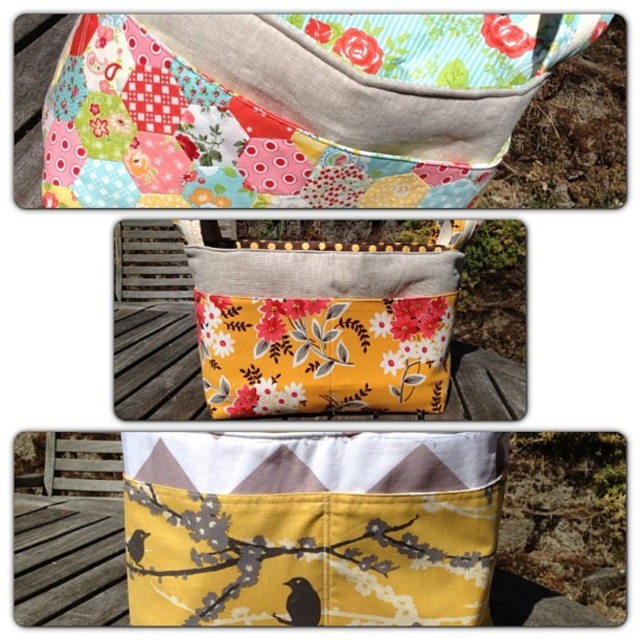
Is yellow fabric pouch at center bigger than black matte bird at lower center?

Yes.

In the scene shown: Between yellow fabric pouch at center and black matte bird at lower center, which one is positioned higher?

Positioned higher is yellow fabric pouch at center.

Where is `yellow fabric pouch at center`? The height and width of the screenshot is (640, 640). yellow fabric pouch at center is located at coordinates (312, 525).

Identify the location of yellow fabric pouch at center. (312, 525).

Which of these two, yellow floral fabric pouch at center or yellow fabric branch at center, stands taller?

Standing taller between the two is yellow floral fabric pouch at center.

Who is positioned more to the right, yellow floral fabric pouch at center or yellow fabric branch at center?

From the viewer's perspective, yellow floral fabric pouch at center appears more on the right side.

This screenshot has width=640, height=640. In order to click on yellow floral fabric pouch at center in this screenshot , I will do `click(324, 314)`.

Can you confirm if yellow fabric pouch at center is positioned to the right of black matte bird at lower left?

Yes, yellow fabric pouch at center is to the right of black matte bird at lower left.

Between yellow fabric pouch at center and black matte bird at lower left, which one appears on the left side from the viewer's perspective?

black matte bird at lower left

Measure the distance between yellow fabric pouch at center and camera.

35.84 inches

Find the location of a particular element. This screenshot has height=640, width=640. yellow fabric pouch at center is located at coordinates (312, 525).